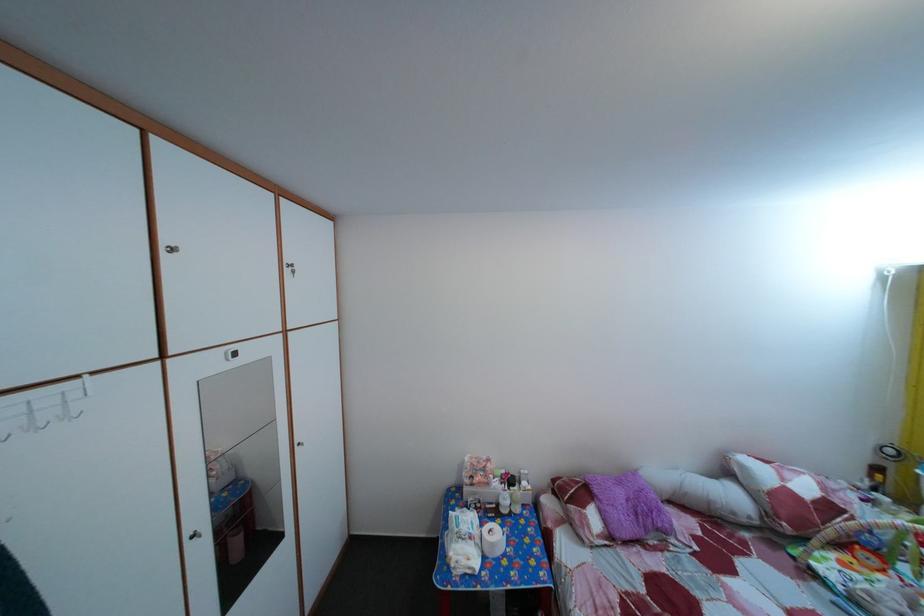
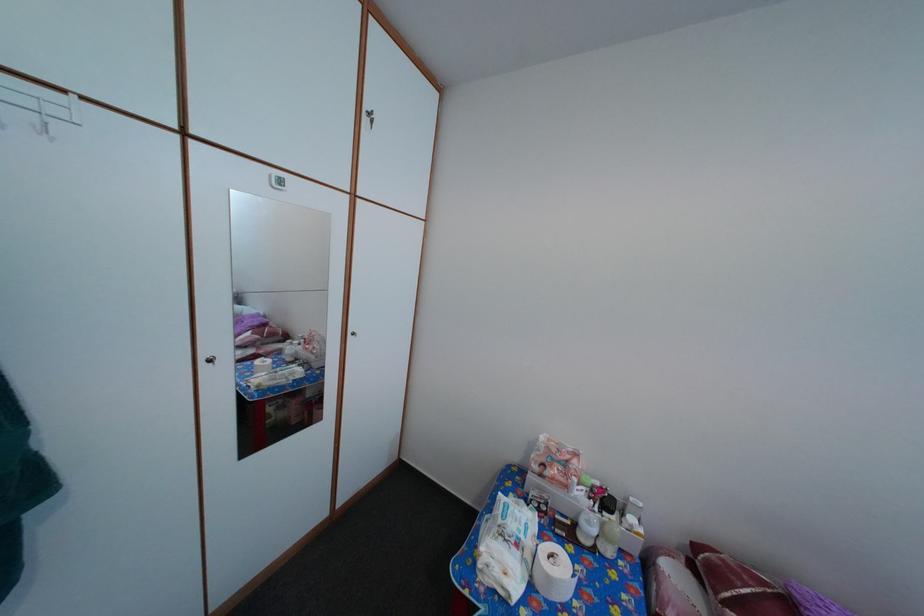
The point at (502, 553) is marked in the first image. Where is the corresponding point in the second image?

(558, 586)